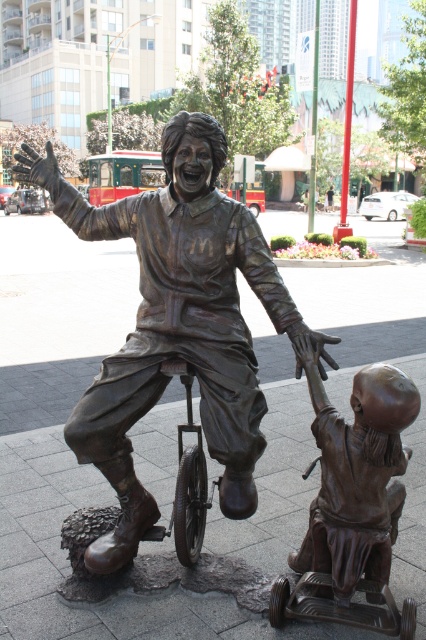
From the picture: You are a tour guide leading a group through the plaza. You want to point out the bronze baby at lower right to your group. Can you see it from your current position in front of the bronze statue at center?

The bronze baby at lower right is behind the bronze statue at center, so you cannot see it from your current position in front of the bronze statue at center. You need to move around the statue to view the bronze baby at lower right.

You are standing in the public square and want to take a photo of the bronze statue at center. Where should you position yourself to ensure the point at coordinates point (178, 323) is in the frame?

Position yourself directly in front of the bronze statue at center so that the point at coordinates point (178, 323), which is located on the bronze statue at center, is centered in your camera frame.

You are a visitor in the plaza and want to take a photo of the bronze statue at center and the bronze baby at lower right together in the same frame. Based on their positions, where should you stand to ensure both are fully visible?

Since the bronze statue at center is above the bronze baby at lower right, you should stand at a lower position to ensure both are fully visible in the frame.